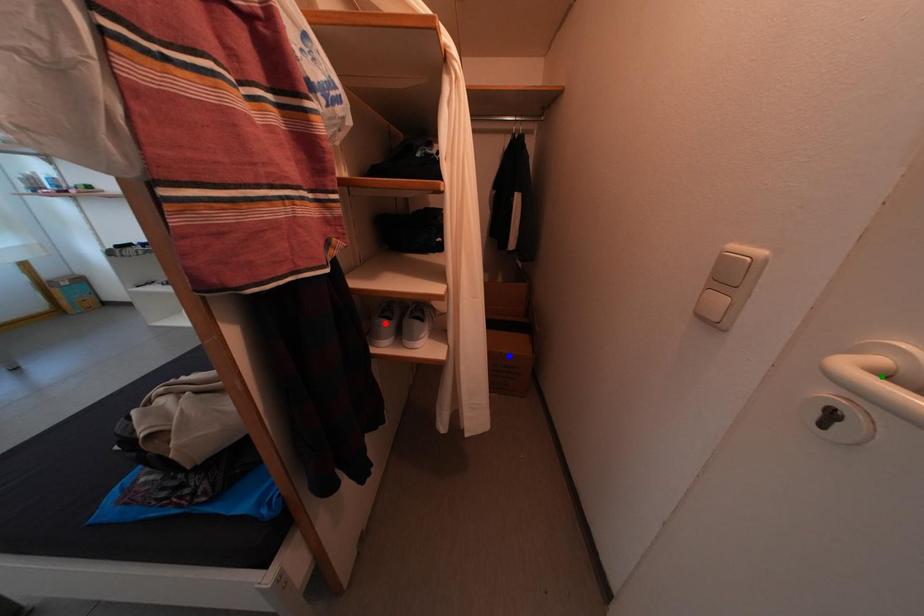
Consider the image. Order these from nearest to farthest:
red point, green point, blue point

green point, red point, blue point